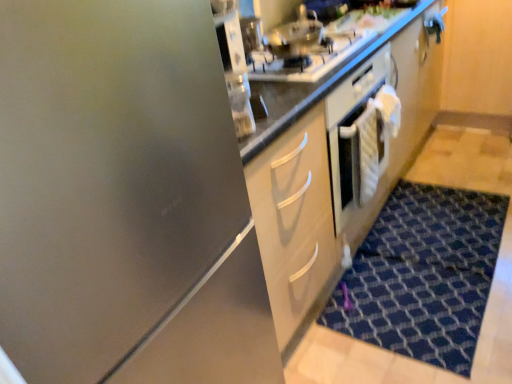
Locate an element on the screen. stainless steel gas stove at upper center is located at coordinates (307, 58).

Considering the sizes of objects stainless steel at upper center and stainless steel gas stove at upper center in the image provided, who is thinner, stainless steel at upper center or stainless steel gas stove at upper center?

Thinner between the two is stainless steel at upper center.

Locate an element on the screen. The image size is (512, 384). stainless steel lying on the right of stainless steel gas stove at upper center is located at coordinates (294, 36).

Who is bigger, stainless steel at upper center or stainless steel gas stove at upper center?

Bigger between the two is stainless steel gas stove at upper center.

From the image's perspective, which is above, blue textured rug at lower right or stainless steel at upper center?

From the image's view, stainless steel at upper center is above.

Based on the photo, from a real-world perspective, between blue textured rug at lower right and stainless steel at upper center, who is vertically lower?

blue textured rug at lower right is physically lower.

Is blue textured rug at lower right not inside stainless steel at upper center?

blue textured rug at lower right lies outside stainless steel at upper center's area.

Does point (353, 287) come closer to viewer compared to point (304, 31)?

That is False.

Considering the sizes of objects stainless steel gas stove at upper center and blue textured rug at lower right in the image provided, who is bigger, stainless steel gas stove at upper center or blue textured rug at lower right?

With larger size is blue textured rug at lower right.

Is stainless steel gas stove at upper center beside blue textured rug at lower right?

No, stainless steel gas stove at upper center is not next to blue textured rug at lower right.

Which of these two, stainless steel gas stove at upper center or blue textured rug at lower right, is thinner?

With smaller width is stainless steel gas stove at upper center.

Can blue textured rug at lower right be found inside stainless steel gas stove at upper center?

Actually, blue textured rug at lower right is outside stainless steel gas stove at upper center.

Can you confirm if stainless steel gas stove at upper center is taller than stainless steel at upper center?

No.

Considering the sizes of objects stainless steel gas stove at upper center and stainless steel at upper center in the image provided, who is bigger, stainless steel gas stove at upper center or stainless steel at upper center?

Bigger between the two is stainless steel gas stove at upper center.

Between stainless steel gas stove at upper center and stainless steel at upper center, which one appears on the right side from the viewer's perspective?

From the viewer's perspective, stainless steel at upper center appears more on the right side.

Is stainless steel gas stove at upper center spatially inside stainless steel at upper center, or outside of it?

stainless steel gas stove at upper center is located beyond the bounds of stainless steel at upper center.

From the picture: Does blue textured rug at lower right turn towards stainless steel gas stove at upper center?

No, blue textured rug at lower right is not aimed at stainless steel gas stove at upper center.

How far apart are blue textured rug at lower right and stainless steel gas stove at upper center?

blue textured rug at lower right is 38.99 inches from stainless steel gas stove at upper center.

How different are the orientations of blue textured rug at lower right and stainless steel gas stove at upper center in degrees?

1.84 degrees separate the facing orientations of blue textured rug at lower right and stainless steel gas stove at upper center.

What are the coordinates of `gas stove above the blue textured rug at lower right (from a real-world perspective)` in the screenshot? It's located at (307, 58).

Can you confirm if stainless steel at upper center is smaller than blue textured rug at lower right?

Yes.

Which object is closer to the camera taking this photo, stainless steel at upper center or blue textured rug at lower right?

blue textured rug at lower right is in front.

Is stainless steel at upper center positioned with its back to blue textured rug at lower right?

That's not correct — stainless steel at upper center is not looking away from blue textured rug at lower right.

Where is `stainless steel to the right of stainless steel gas stove at upper center`? Image resolution: width=512 pixels, height=384 pixels. stainless steel to the right of stainless steel gas stove at upper center is located at coordinates (294, 36).

Find the location of `stainless steel above the blue textured rug at lower right (from the image's perspective)`. stainless steel above the blue textured rug at lower right (from the image's perspective) is located at coordinates (294, 36).

Estimate the real-world distances between objects in this image. Which object is further from stainless steel gas stove at upper center, stainless steel at upper center or blue textured rug at lower right?

The object further to stainless steel gas stove at upper center is blue textured rug at lower right.

Which object lies nearer to the anchor point blue textured rug at lower right, stainless steel at upper center or stainless steel gas stove at upper center?

The object closer to blue textured rug at lower right is stainless steel gas stove at upper center.

Which object lies nearer to the anchor point stainless steel at upper center, stainless steel gas stove at upper center or blue textured rug at lower right?

stainless steel gas stove at upper center is closer to stainless steel at upper center.

In the scene shown: Considering their positions, is blue textured rug at lower right positioned further to stainless steel at upper center than stainless steel gas stove at upper center?

blue textured rug at lower right lies further to stainless steel at upper center than the other object.

Based on their spatial positions, is stainless steel gas stove at upper center or stainless steel at upper center further from blue textured rug at lower right?

Among the two, stainless steel at upper center is located further to blue textured rug at lower right.

When comparing their distances from stainless steel gas stove at upper center, does blue textured rug at lower right or stainless steel at upper center seem further?

Among the two, blue textured rug at lower right is located further to stainless steel gas stove at upper center.

Find the location of a particular element. The width and height of the screenshot is (512, 384). gas stove between stainless steel at upper center and blue textured rug at lower right in the vertical direction is located at coordinates (307, 58).